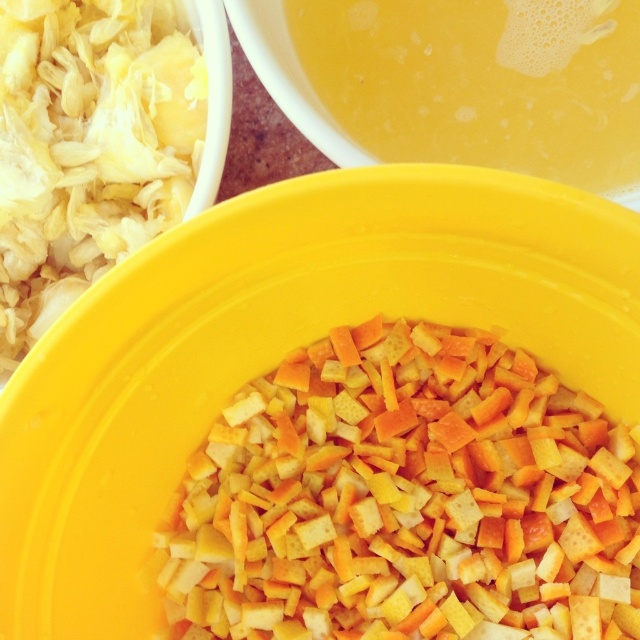
Which of these two, white shredded cabbage at upper left or yellow liquid at upper center, stands shorter?

yellow liquid at upper center is shorter.

Is point (156, 22) behind point (449, 154)?

That is False.

Is point (65, 292) more distant than point (577, 166)?

No, (65, 292) is in front of (577, 166).

The image size is (640, 640). What are the coordinates of `white shredded cabbage at upper left` in the screenshot? It's located at (88, 147).

Who is lower down, yellow crumbly at center or yellow liquid at upper center?

yellow crumbly at center is lower down.

Between point (257, 388) and point (432, 83), which one is positioned behind?

The point (432, 83) is behind.

Locate an element on the screen. Image resolution: width=640 pixels, height=640 pixels. yellow crumbly at center is located at coordinates (403, 499).

Looking at this image, who is positioned more to the right, yellow crumbly at center or white shredded cabbage at upper left?

Positioned to the right is yellow crumbly at center.

In the scene shown: Is yellow crumbly at center to the right of white shredded cabbage at upper left from the viewer's perspective?

Yes, yellow crumbly at center is to the right of white shredded cabbage at upper left.

What are the coordinates of `yellow crumbly at center` in the screenshot? It's located at (403, 499).

You are a GUI agent. You are given a task and a screenshot of the screen. Output one action in this format:
    pyautogui.click(x=<x>, y=<y>)
    Task: Click on the yellow crumbly at center
    This screenshot has width=640, height=640.
    Given the screenshot: What is the action you would take?
    click(x=403, y=499)